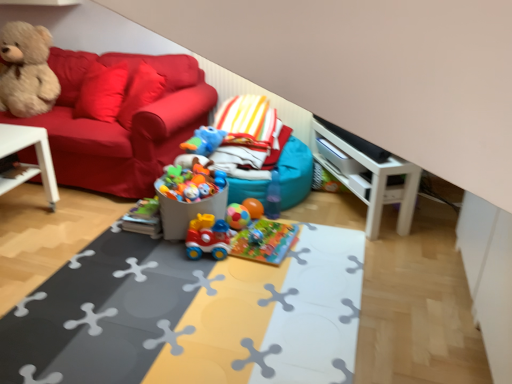
Question: From the image's perspective, is rubberized plastic play mat at center, the first table in the right-to-left sequence, located above or below rubberized plastic toy train at center, arranged as the first toy when ordered from the bottom?

Choices:
 (A) below
 (B) above

Answer: (A)

Question: Is rubberized plastic play mat at center, the second table positioned from the left, spatially inside rubberized plastic toy train at center, the 4th toy from the top, or outside of it?

Choices:
 (A) outside
 (B) inside

Answer: (A)

Question: Based on their relative distances, which object is nearer to the rubberized plastic toy train at center, the 4th toy from the top?

Choices:
 (A) white glossy entertainment center at right
 (B) rubberized plastic play mat at center, the second table positioned from the left
 (C) teal fabric bean bag at center
 (D) rubber duck at center, the first toy when ordered from top to bottom
 (E) fluffy beige teddy bear at upper left

Answer: (B)

Question: Considering the real-world distances, which object is closest to the rubber ball at center, marked as the 2th toy in a bottom-to-top arrangement?

Choices:
 (A) velvet teddy bear at left
 (B) white plastic table at left, which is the 1th table in left-to-right order
 (C) rubberized multicolored balls at center, placed as the second toy when sorted from top to bottom
 (D) rubberized plastic play mat at center, the first table in the right-to-left sequence
 (E) fluffy beige teddy bear at upper left

Answer: (C)